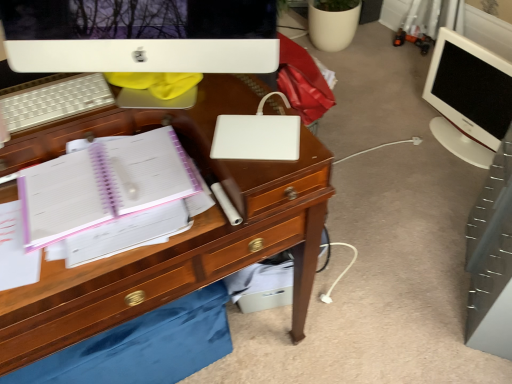
Question: Is white matte laptop at center surrounded by white glossy monitor at right, the first computer monitor viewed from the right?

Choices:
 (A) yes
 (B) no

Answer: (B)

Question: Is the depth of white glossy monitor at right, the first computer monitor viewed from the right, greater than that of white matte laptop at center?

Choices:
 (A) yes
 (B) no

Answer: (A)

Question: Is white glossy monitor at right, the 2th computer monitor in the left-to-right sequence, positioned with its back to white matte laptop at center?

Choices:
 (A) yes
 (B) no

Answer: (B)

Question: From the image's perspective, is white glossy monitor at right, the 2th computer monitor in the left-to-right sequence, under white matte laptop at center?

Choices:
 (A) no
 (B) yes

Answer: (A)

Question: Is white glossy monitor at right, the 2th computer monitor in the left-to-right sequence, closer to the viewer compared to white matte laptop at center?

Choices:
 (A) yes
 (B) no

Answer: (B)

Question: Considering the relative sizes of white glossy monitor at right, the first computer monitor viewed from the right, and white matte laptop at center in the image provided, is white glossy monitor at right, the first computer monitor viewed from the right, smaller than white matte laptop at center?

Choices:
 (A) no
 (B) yes

Answer: (A)

Question: Can you confirm if white glossy monitor at right, the first computer monitor viewed from the right, is positioned to the left of white glossy computer monitor at upper center, marked as the 1th computer monitor in a front-to-back arrangement?

Choices:
 (A) yes
 (B) no

Answer: (B)

Question: Is white glossy monitor at right, the second computer monitor positioned from the front, located outside white glossy computer monitor at upper center, marked as the 1th computer monitor in a front-to-back arrangement?

Choices:
 (A) yes
 (B) no

Answer: (A)

Question: From a real-world perspective, does white glossy monitor at right, the second computer monitor positioned from the front, sit lower than white glossy computer monitor at upper center, marked as the 1th computer monitor in a front-to-back arrangement?

Choices:
 (A) no
 (B) yes

Answer: (B)

Question: Is the surface of white glossy monitor at right, positioned as the first computer monitor in back-to-front order, in direct contact with white glossy computer monitor at upper center, marked as the 1th computer monitor in a front-to-back arrangement?

Choices:
 (A) no
 (B) yes

Answer: (A)

Question: Is the depth of white glossy monitor at right, the second computer monitor positioned from the front, greater than that of white glossy computer monitor at upper center, which appears as the 2th computer monitor when viewed from the right?

Choices:
 (A) yes
 (B) no

Answer: (A)

Question: Does white glossy monitor at right, the 2th computer monitor in the left-to-right sequence, contain white glossy computer monitor at upper center, which ranks as the 1th computer monitor in left-to-right order?

Choices:
 (A) no
 (B) yes

Answer: (A)

Question: Is white plastic keyboard at upper left smaller than white glossy monitor at right, the second computer monitor positioned from the front?

Choices:
 (A) yes
 (B) no

Answer: (A)